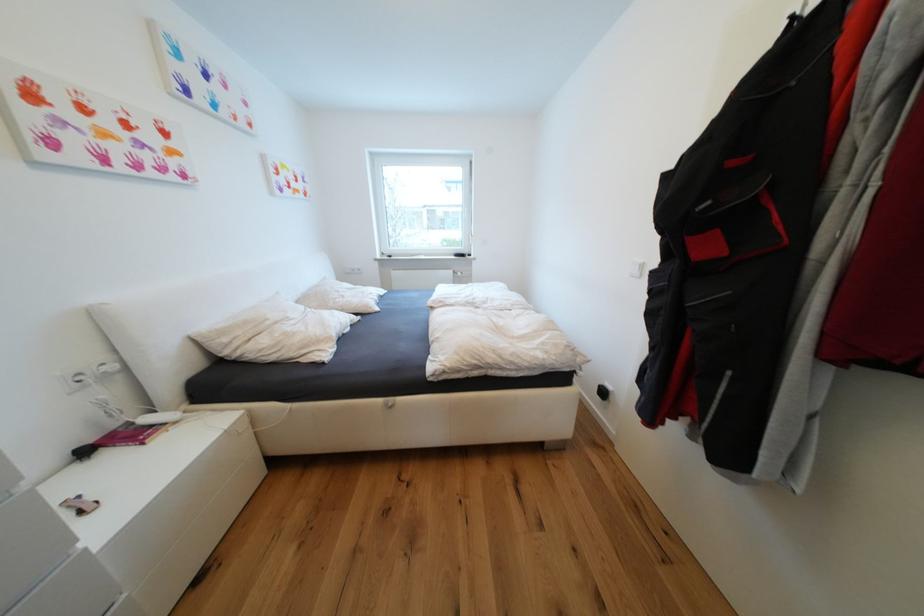
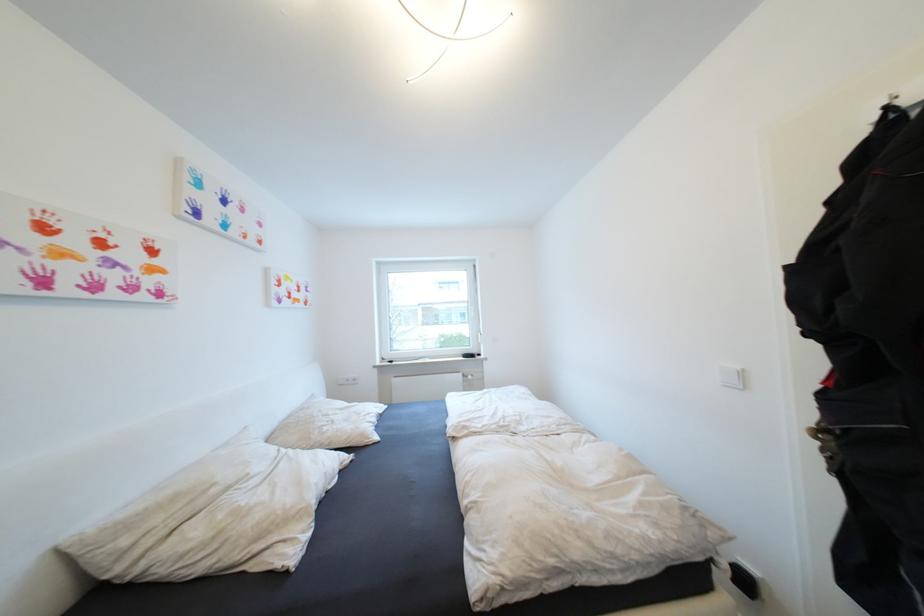
The point at (360, 270) is marked in the first image. Where is the corresponding point in the second image?

(355, 381)